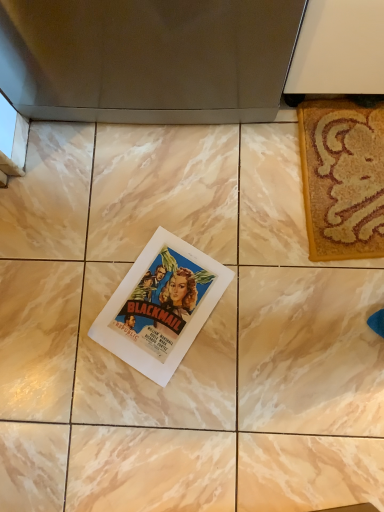
Identify the location of vacant area that is in front of white paper at center. Image resolution: width=384 pixels, height=512 pixels. (192, 406).